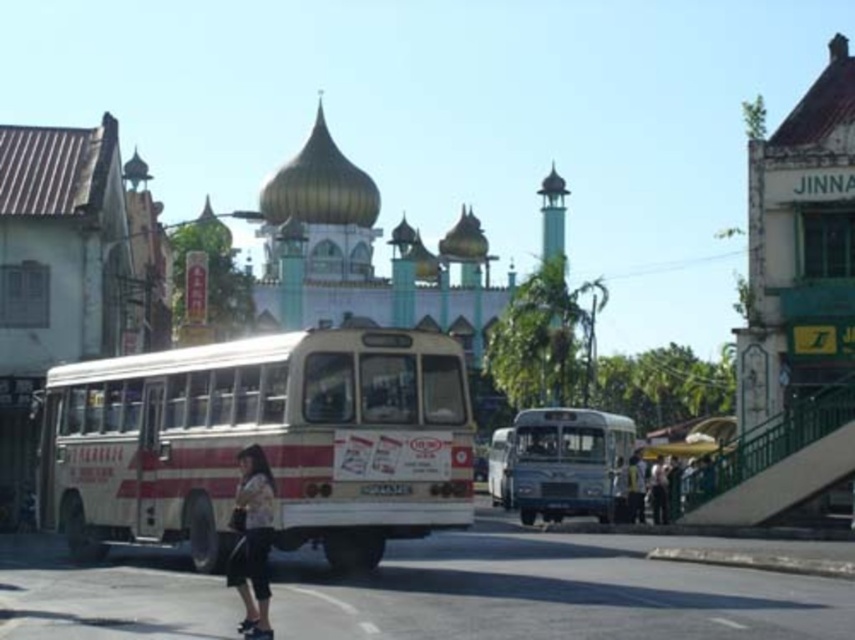
Who is shorter, white painted metal bus at center or white matte bus at center?

white matte bus at center is shorter.

Is point (380, 444) less distant than point (497, 454)?

Yes, it is in front of point (497, 454).

The height and width of the screenshot is (640, 855). In order to click on white painted metal bus at center in this screenshot , I will do `click(261, 442)`.

Is point (239, 529) positioned after point (652, 520)?

No, (239, 529) is closer to viewer.

Is light beige fabric pants at lower left bigger than dark gray fabric jacket at lower right?

No, light beige fabric pants at lower left is not bigger than dark gray fabric jacket at lower right.

Does point (258, 492) lie in front of point (658, 490)?

Yes, it is in front of point (658, 490).

Find the location of a particular element. The width and height of the screenshot is (855, 640). light beige fabric pants at lower left is located at coordinates (252, 541).

Can you confirm if metallic silver bus at center is thinner than white matte bus at center?

Incorrect, metallic silver bus at center's width is not less than white matte bus at center's.

In the scene shown: Between metallic silver bus at center and white matte bus at center, which one appears on the right side from the viewer's perspective?

Positioned to the right is metallic silver bus at center.

Who is more forward, (x=593, y=497) or (x=500, y=467)?

Point (x=593, y=497)

I want to click on metallic silver bus at center, so click(565, 461).